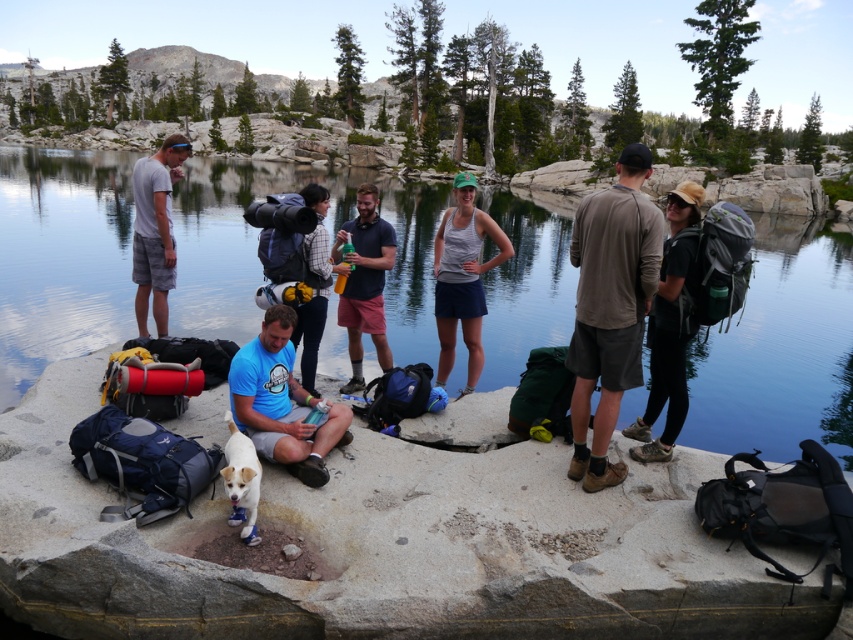
Question: Among these points, which one is nearest to the camera?

Choices:
 (A) (225, 435)
 (B) (253, 435)

Answer: (B)

Question: Among these objects, which one is farthest from the camera?

Choices:
 (A) transparent blue water at center
 (B) matte gray tank top at center
 (C) matte gray t-shirt at left
 (D) brown cotton shirt at right

Answer: (C)

Question: Can you confirm if transparent blue water at center is bigger than dark blue t-shirt at center?

Choices:
 (A) no
 (B) yes

Answer: (B)

Question: Which point is farther from the camera taking this photo?

Choices:
 (A) (631, 252)
 (B) (439, 260)

Answer: (B)

Question: Is the position of brown cotton shirt at right less distant than that of matte gray t-shirt at left?

Choices:
 (A) no
 (B) yes

Answer: (B)

Question: Can you confirm if matte gray tank top at center is wider than white fur dog at center?

Choices:
 (A) yes
 (B) no

Answer: (A)